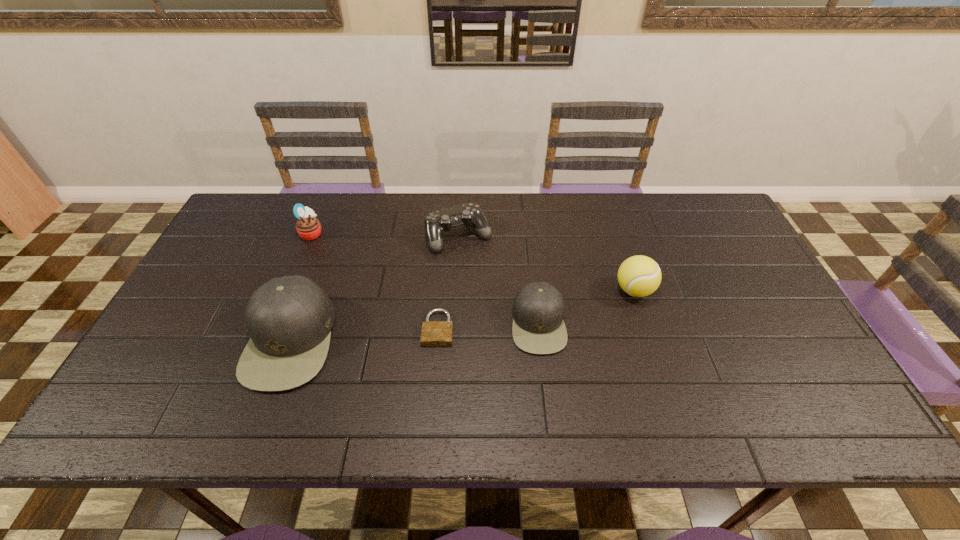
Where is `blank area located on the brim of the tallest object`? This screenshot has width=960, height=540. blank area located on the brim of the tallest object is located at coordinates (221, 340).

Locate an element on the screen. The image size is (960, 540). free location located 0.120m on the brim of the fifth object from left to right is located at coordinates (466, 323).

Identify the location of vacant space situated on the brim of the fifth object from left to right. (462, 323).

Identify the location of free space located 0.050m on the brim of the fifth object from left to right. (492, 323).

At what (x,y) coordinates should I click in order to perform the action: click on vacant space located 0.250m on the front of the control. Please return your answer as a coordinate pair (x, y). Looking at the image, I should click on (455, 321).

Locate an element on the screen. The height and width of the screenshot is (540, 960). vacant space located 0.090m on the front-facing side of the muffin is located at coordinates (351, 233).

This screenshot has width=960, height=540. What are the coordinates of `vacant space located on the keyhole side of the padlock` in the screenshot? It's located at (435, 371).

This screenshot has height=540, width=960. In order to click on vacant position located on the right of the tennis ball in this screenshot , I will do `click(680, 290)`.

In order to click on control that is at the far edge in this screenshot , I will do `click(436, 223)`.

Where is `muffin present at the far edge`? This screenshot has height=540, width=960. muffin present at the far edge is located at coordinates (308, 227).